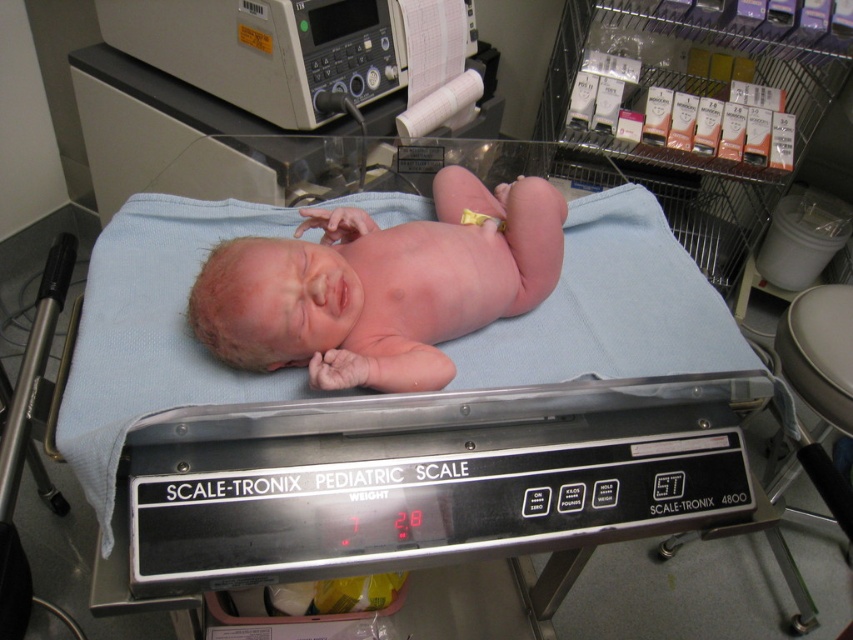
In the scene shown: You are a nurse who needs to place the yellow fabric diaper at center onto the blue fabric hospital bed at center for a baby. Given that the distance between them is 12.54 inches, can you easily reach to move the diaper without moving your position?

The blue fabric hospital bed at center and yellow fabric diaper at center are 12.54 inches apart. Since this distance is within a typical arm reach, you can easily move the yellow fabric diaper at center to the blue fabric hospital bed at center without needing to adjust your position.

You are a nurse preparing to place a newborn baby on the blue fabric hospital bed at center and the yellow fabric diaper at center. Which object is taller and needs to be adjusted to ensure the baby is placed safely?

The blue fabric hospital bed at center is taller than the yellow fabric diaper at center, so you should lower the bed or raise the diaper to ensure the baby is placed safely.

You are a nurse checking the baby in the room. You need to know if the pink smooth skin at center is smaller than the gray plastic monitor at upper left. Can you confirm this?

The pink smooth skin at center has a smaller size compared to the gray plastic monitor at upper left, so yes, the pink smooth skin at center is smaller than the gray plastic monitor at upper left.